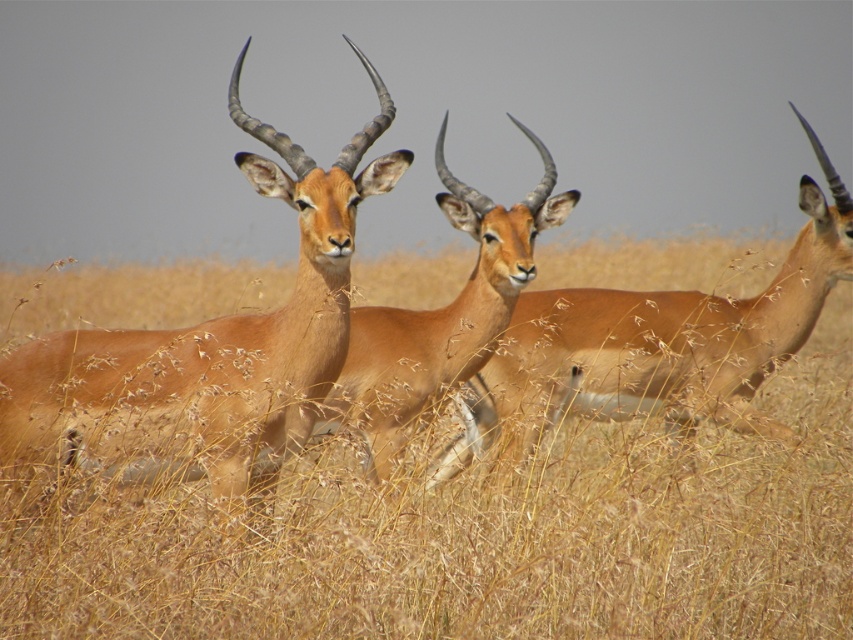
Question: Which point appears closest to the camera in this image?

Choices:
 (A) (494, 284)
 (B) (787, 301)
 (C) (334, 237)
 (D) (683, 568)

Answer: (C)

Question: Considering the relative positions of brown glossy antelope at center and brown matte/deer at center in the image provided, where is brown glossy antelope at center located with respect to brown matte/deer at center?

Choices:
 (A) above
 (B) below

Answer: (B)

Question: Estimate the real-world distances between objects in this image. Which object is closer to the brown glossy antelope at center?

Choices:
 (A) brown dry grass at center
 (B) brown velvet antelope at center
 (C) brown matte/deer at center

Answer: (C)

Question: Considering the real-world distances, which object is closest to the brown velvet antelope at center?

Choices:
 (A) brown dry grass at center
 (B) brown glossy antelope at center

Answer: (B)

Question: Does brown dry grass at center appear under brown glossy antelope at center?

Choices:
 (A) no
 (B) yes

Answer: (A)

Question: Does brown velvet antelope at center have a larger size compared to brown glossy antelope at center?

Choices:
 (A) yes
 (B) no

Answer: (B)